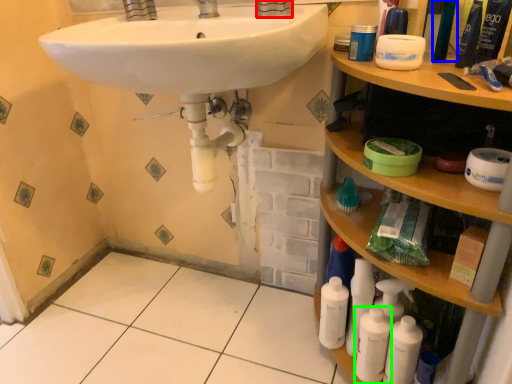
Question: Considering the real-world distances, which object is farthest from faucet (highlighted by a red box)? mouthwash (highlighted by a blue box) or cleaning product (highlighted by a green box)?

Choices:
 (A) mouthwash
 (B) cleaning product

Answer: (B)